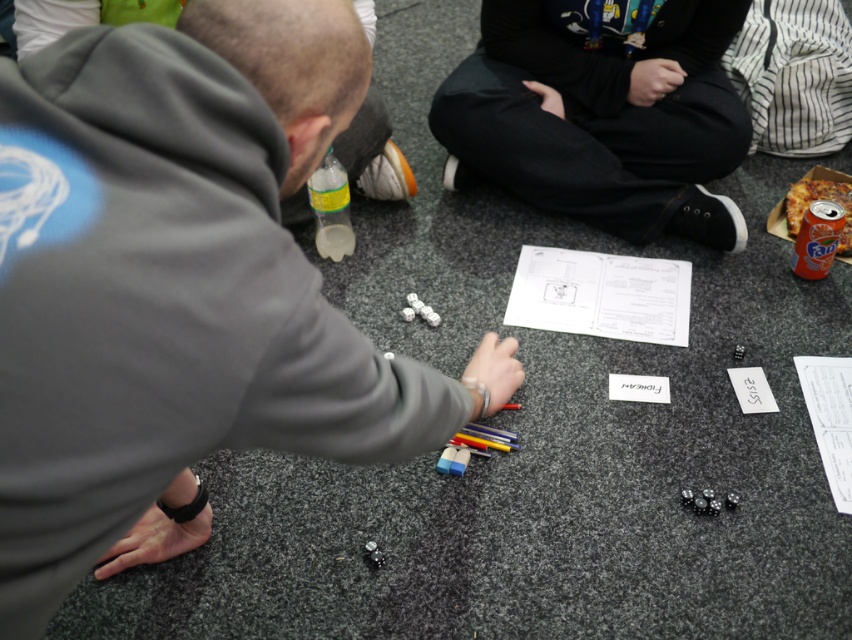
Looking at this image, between gray hoodie at center and clear plastic bottle at center, which one is positioned higher?

gray hoodie at center is above.

Is gray hoodie at center closer to the viewer compared to clear plastic bottle at center?

Yes, it is.

The width and height of the screenshot is (852, 640). Describe the element at coordinates (49, 20) in the screenshot. I see `gray hoodie at center` at that location.

This screenshot has width=852, height=640. What are the coordinates of `gray hoodie at center` in the screenshot? It's located at (49, 20).

Between black cotton pants at center and clear plastic bottle at center, which one appears on the left side from the viewer's perspective?

clear plastic bottle at center is more to the left.

Does black cotton pants at center appear under clear plastic bottle at center?

Actually, black cotton pants at center is above clear plastic bottle at center.

Is point (669, 177) closer to camera compared to point (334, 161)?

No, (669, 177) is further to viewer.

Identify the location of black cotton pants at center. (603, 113).

Does matte gray hoodie at center have a greater width compared to clear plastic bottle at center?

Correct, the width of matte gray hoodie at center exceeds that of clear plastic bottle at center.

Which is behind, point (53, 230) or point (352, 232)?

The point (352, 232) is more distant.

Where is `matte gray hoodie at center`? The image size is (852, 640). matte gray hoodie at center is located at coordinates (177, 282).